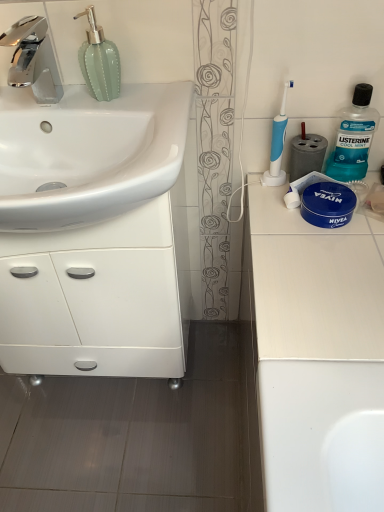
Image resolution: width=384 pixels, height=512 pixels. Find the location of `vacant area located to the right-hand side of chrome metallic faucet at upper left`. vacant area located to the right-hand side of chrome metallic faucet at upper left is located at coordinates (120, 104).